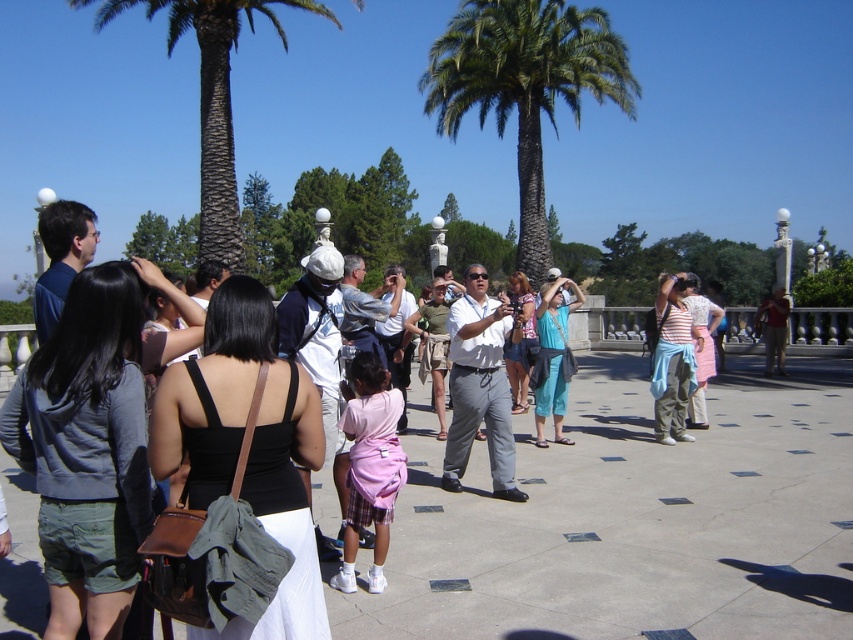
You are a photographer trying to capture a photo of the khaki cotton shorts at center while ensuring the green textured palm tree at upper left is visible in the background. Given their sizes, will the palm tree appear larger or smaller in the photo compared to the shorts?

The green textured palm tree at upper left is wider than the khaki cotton shorts at center. Since the palm tree is in the background and wider, it will appear larger in the photo compared to the shorts.

You are a tour guide who needs to ensure that all participants can hear your instructions clearly. The sound carries well in this open area, but you want to make sure that the person farthest away from you can still hear you. You are standing near the green textured palm tree at upper left. The participant wearing khaki cotton shorts at center is 15.63 meters away from you. Is this participant within the optimal hearing range of 20 meters for clear communication?

The participant wearing khaki cotton shorts at center is 15.63 meters away from the green textured palm tree at upper left, which is within the optimal hearing range of 20 meters. Therefore, they should be able to hear the instructions clearly.